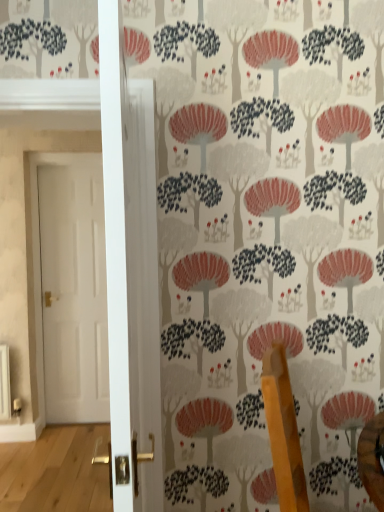
At what (x,y) coordinates should I click in order to perform the action: click on free space above white glossy door at left (from a real-world perspective). Please return your answer as a coordinate pair (x, y). The height and width of the screenshot is (512, 384). Looking at the image, I should click on (66, 152).